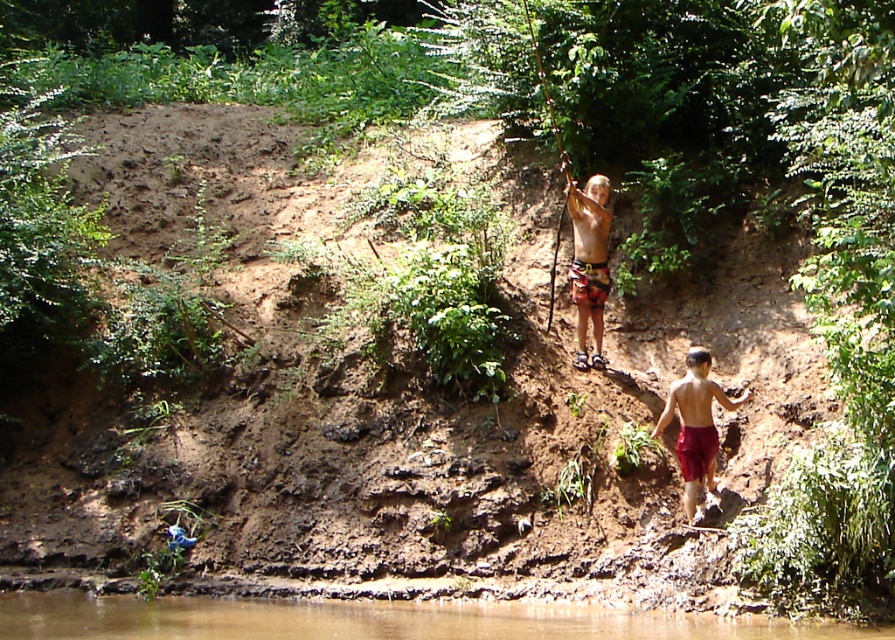
Question: Which object is closer to the camera taking this photo?

Choices:
 (A) brown muddy water at lower center
 (B) multicolored shorts at center
 (C) red cotton shorts at lower right

Answer: (A)

Question: Which object is closer to the camera taking this photo?

Choices:
 (A) multicolored shorts at center
 (B) brown muddy water at lower center

Answer: (B)

Question: Does multicolored shorts at center have a larger size compared to red cotton shorts at lower right?

Choices:
 (A) no
 (B) yes

Answer: (A)

Question: Based on their relative distances, which object is farther from the multicolored shorts at center?

Choices:
 (A) brown muddy water at lower center
 (B) red cotton shorts at lower right

Answer: (A)

Question: Does multicolored shorts at center come in front of red cotton shorts at lower right?

Choices:
 (A) no
 (B) yes

Answer: (A)

Question: In this image, where is brown muddy water at lower center located relative to red cotton shorts at lower right?

Choices:
 (A) above
 (B) below

Answer: (B)